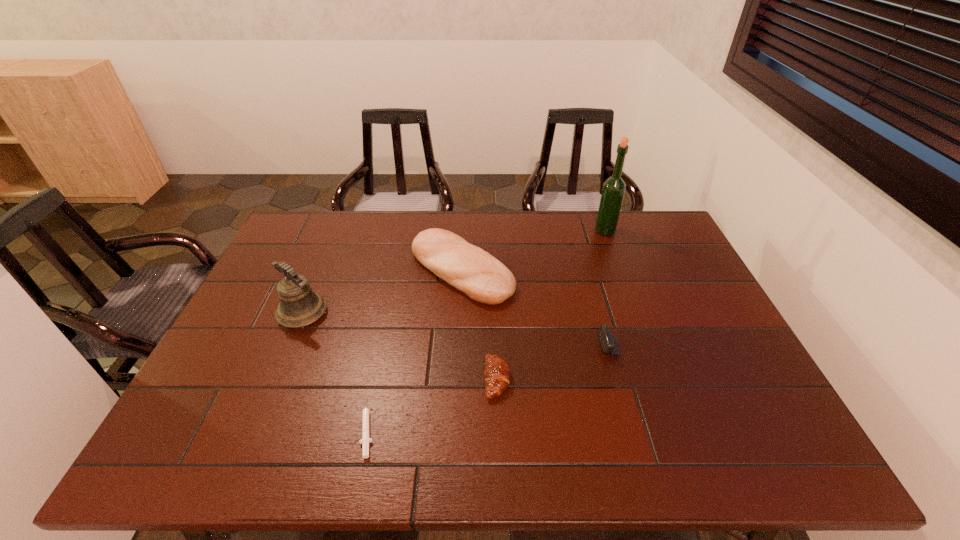
At what (x,y) coordinates should I click in order to perform the action: click on free spot that satisfies the following two spatial constraints: 1. on the back side of the liquor; 2. on the left side of the second shortest object. Please return your answer as a coordinate pair (x, y). The width and height of the screenshot is (960, 540). Looking at the image, I should click on (492, 231).

Where is `vacant space that satisfies the following two spatial constraints: 1. on the front-facing side of the fourth tallest object; 2. on the front side of the second shortest object`? The height and width of the screenshot is (540, 960). vacant space that satisfies the following two spatial constraints: 1. on the front-facing side of the fourth tallest object; 2. on the front side of the second shortest object is located at coordinates (656, 379).

This screenshot has height=540, width=960. Identify the location of blank space that satisfies the following two spatial constraints: 1. on the front side of the liquor; 2. on the front-facing side of the webcam. (647, 345).